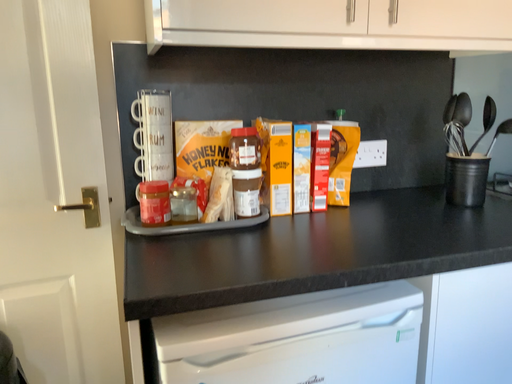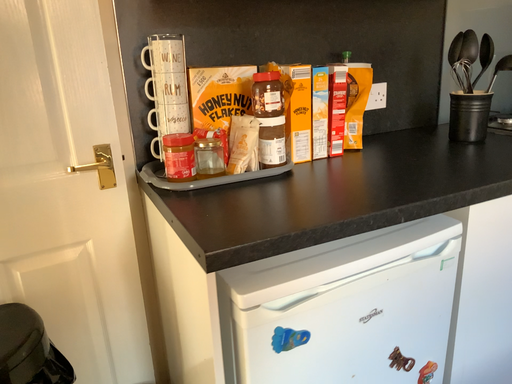
Question: Which way did the camera rotate in the video?

Choices:
 (A) rotated left
 (B) rotated right

Answer: (B)